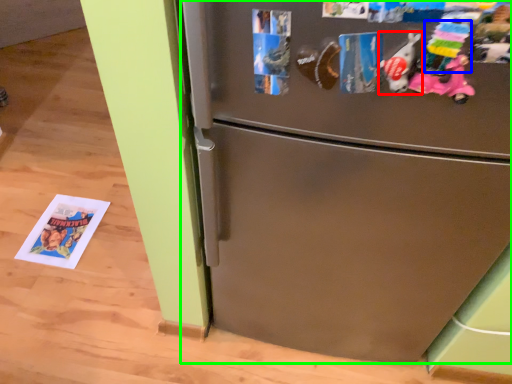
Question: Considering the real-world distances, which object is closest to toy (highlighted by a red box)? toy (highlighted by a blue box) or refrigerator (highlighted by a green box).

Choices:
 (A) toy
 (B) refrigerator

Answer: (A)